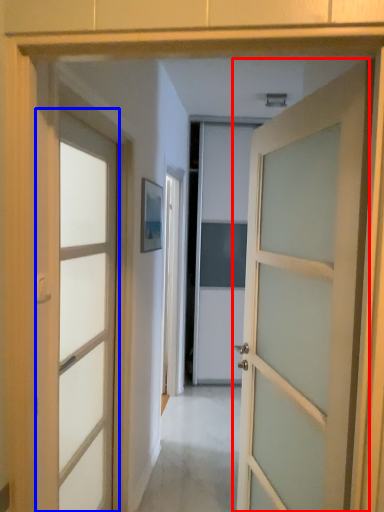
Question: Which object appears closest to the camera in this image, door (highlighted by a red box) or door (highlighted by a blue box)?

Choices:
 (A) door
 (B) door

Answer: (A)